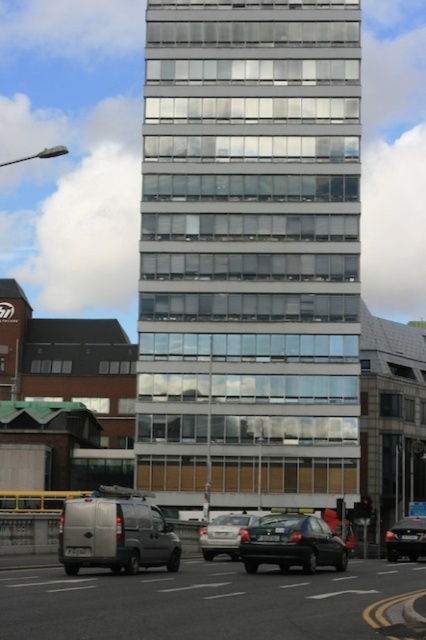
Which is behind, point (144, 353) or point (337, 563)?

Point (144, 353)

Which is more to the right, clear glass building at center or shiny black sedan at center?

shiny black sedan at center is more to the right.

Does point (287, 36) come farther from viewer compared to point (290, 556)?

Yes, point (287, 36) is behind point (290, 556).

Find the location of a particular element. clear glass building at center is located at coordinates (250, 253).

You are a GUI agent. You are given a task and a screenshot of the screen. Output one action in this format:
    pyautogui.click(x=<x>, y=<y>)
    Task: Click on the clear glass building at center
    This screenshot has width=426, height=640.
    Given the screenshot: What is the action you would take?
    pyautogui.click(x=250, y=253)

Which of these two, clear glass building at center or shiny black sedan at lower right, stands taller?

Standing taller between the two is clear glass building at center.

In order to click on clear glass building at center in this screenshot , I will do `click(250, 253)`.

Who is more forward, (63, 529) or (203, 547)?

Point (63, 529)

Does silver metallic van at lower left have a larger size compared to silver metallic sedan at center?

No.

The image size is (426, 640). Describe the element at coordinates (115, 532) in the screenshot. I see `silver metallic van at lower left` at that location.

Where is `silver metallic van at lower left`? silver metallic van at lower left is located at coordinates (115, 532).